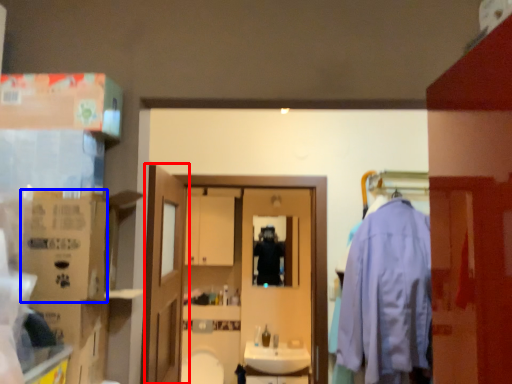
Question: Which object appears farthest to the camera in this image, door (highlighted by a red box) or cardboard box (highlighted by a blue box)?

Choices:
 (A) door
 (B) cardboard box

Answer: (A)